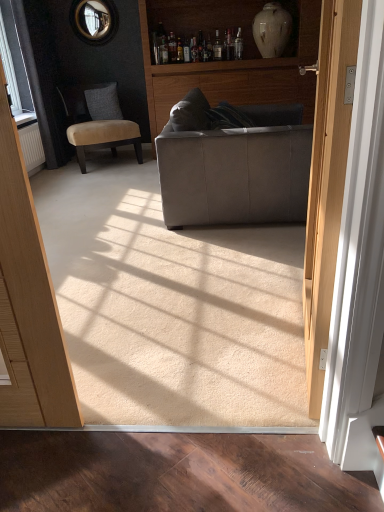
Question: Does point (206, 216) appear closer or farther from the camera than point (160, 9)?

Choices:
 (A) farther
 (B) closer

Answer: (B)

Question: Looking at the image, does suede gray couch at center seem bigger or smaller compared to matte gray couch at center?

Choices:
 (A) small
 (B) big

Answer: (A)

Question: Based on their relative distances, which object is nearer to the suede gray couch at center?

Choices:
 (A) matte gray couch at center
 (B) suede-like gray pillow at left
 (C) white glossy vase at upper center
 (D) velvet beige chair at left

Answer: (A)

Question: Estimate the real-world distances between objects in this image. Which object is closer to the white glossy vase at upper center?

Choices:
 (A) matte gray couch at center
 (B) velvet beige chair at left
 (C) suede gray couch at center
 (D) suede-like gray pillow at left

Answer: (A)